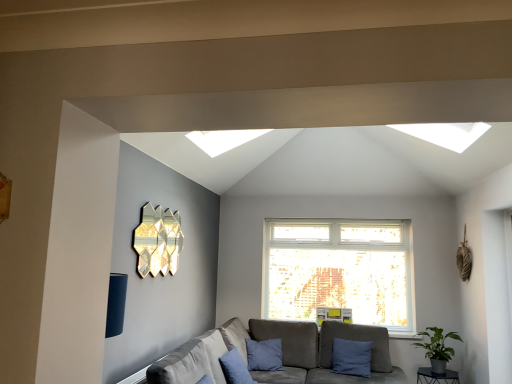
Question: From the image's perspective, is green matte plant at lower right beneath blue fabric pillow at lower right, which is the second pillow in front-to-back order?

Choices:
 (A) no
 (B) yes

Answer: (A)

Question: From a real-world perspective, is green matte plant at lower right below blue fabric pillow at lower right, the second pillow positioned from the left?

Choices:
 (A) yes
 (B) no

Answer: (B)

Question: Is green matte plant at lower right to the left of blue fabric pillow at lower right, the second pillow positioned from the left, from the viewer's perspective?

Choices:
 (A) no
 (B) yes

Answer: (A)

Question: Considering the relative sizes of green matte plant at lower right and blue fabric pillow at lower right, which is the second pillow in front-to-back order, in the image provided, is green matte plant at lower right wider than blue fabric pillow at lower right, which is the second pillow in front-to-back order,?

Choices:
 (A) yes
 (B) no

Answer: (A)

Question: Is green matte plant at lower right closer to camera compared to blue fabric pillow at lower right, arranged as the first pillow when viewed from the back?

Choices:
 (A) no
 (B) yes

Answer: (B)

Question: From a real-world perspective, is gold metallic wall art at upper left positioned above or below green matte plant at lower right?

Choices:
 (A) above
 (B) below

Answer: (A)

Question: Is gold metallic wall art at upper left to the left or to the right of green matte plant at lower right in the image?

Choices:
 (A) left
 (B) right

Answer: (A)

Question: From their relative heights in the image, would you say gold metallic wall art at upper left is taller or shorter than green matte plant at lower right?

Choices:
 (A) tall
 (B) short

Answer: (A)

Question: Relative to green matte plant at lower right, is gold metallic wall art at upper left in front or behind?

Choices:
 (A) behind
 (B) front

Answer: (B)

Question: Does point (225, 365) appear closer or farther from the camera than point (365, 364)?

Choices:
 (A) closer
 (B) farther

Answer: (A)

Question: Considering the positions of blue cotton pillow at lower center, the 2th pillow viewed from the back, and blue fabric pillow at lower right, the second pillow positioned from the left, in the image, is blue cotton pillow at lower center, the 2th pillow viewed from the back, bigger or smaller than blue fabric pillow at lower right, the second pillow positioned from the left,?

Choices:
 (A) big
 (B) small

Answer: (A)

Question: From the image's perspective, relative to blue fabric pillow at lower right, arranged as the 1th pillow when viewed from the right, is blue cotton pillow at lower center, positioned as the first pillow in front-to-back order, above or below?

Choices:
 (A) below
 (B) above

Answer: (B)

Question: Do you think blue cotton pillow at lower center, positioned as the first pillow in front-to-back order, is within blue fabric pillow at lower right, arranged as the 1th pillow when viewed from the right, or outside of it?

Choices:
 (A) inside
 (B) outside

Answer: (B)

Question: Considering the relative positions of blue cotton pillow at lower center, positioned as the first pillow in front-to-back order, and gray fabric couch at lower center in the image provided, is blue cotton pillow at lower center, positioned as the first pillow in front-to-back order, to the left or to the right of gray fabric couch at lower center?

Choices:
 (A) left
 (B) right

Answer: (A)

Question: Considering the positions of blue cotton pillow at lower center, the 2th pillow viewed from the back, and gray fabric couch at lower center in the image, is blue cotton pillow at lower center, the 2th pillow viewed from the back, taller or shorter than gray fabric couch at lower center?

Choices:
 (A) short
 (B) tall

Answer: (A)